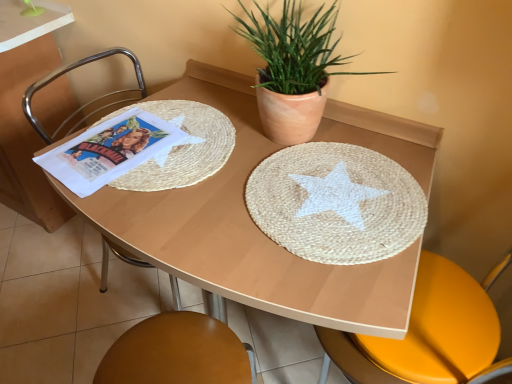
Locate an element on the screen. This screenshot has width=512, height=384. blank space situated above natural fiber placemat at center (from a real-world perspective) is located at coordinates (339, 194).